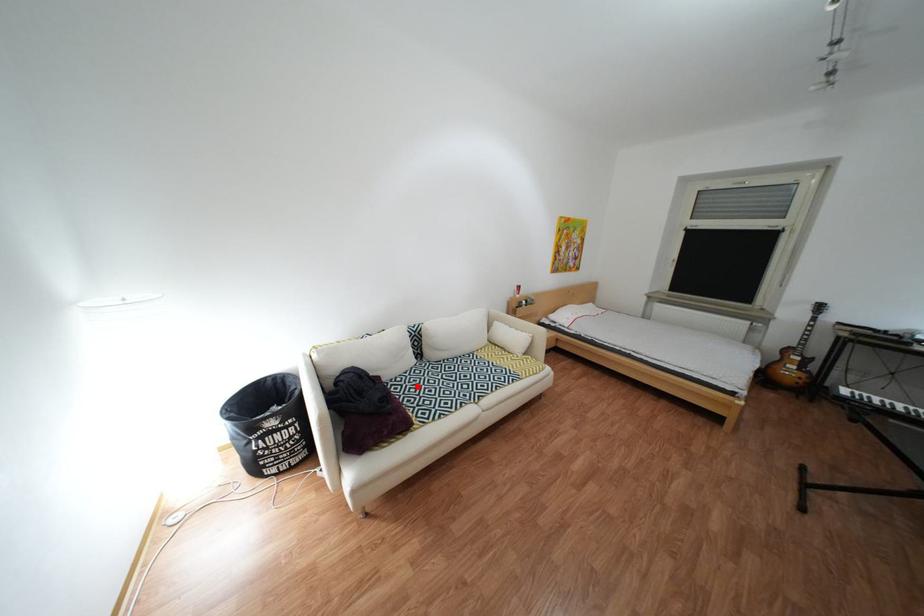
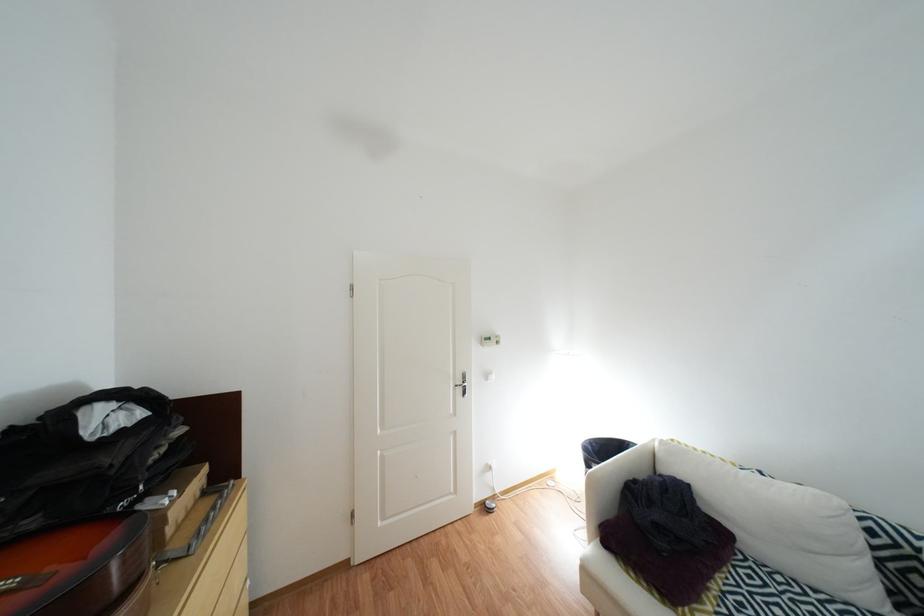
Where in the second image is the point corresponding to the highlighted location from the first image?

(782, 586)